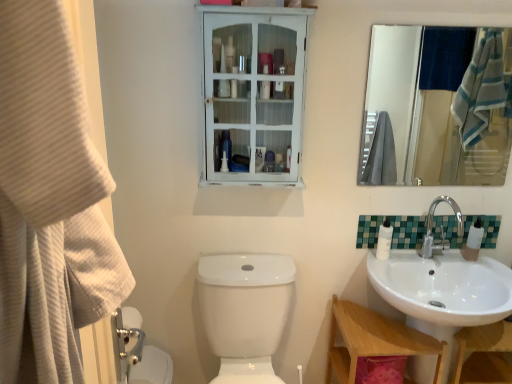
Image resolution: width=512 pixels, height=384 pixels. Identify the location of free space above white glossy toilet bowl at lower left, the first toilet bowl when ordered from left to right (from a real-world perspective). (153, 357).